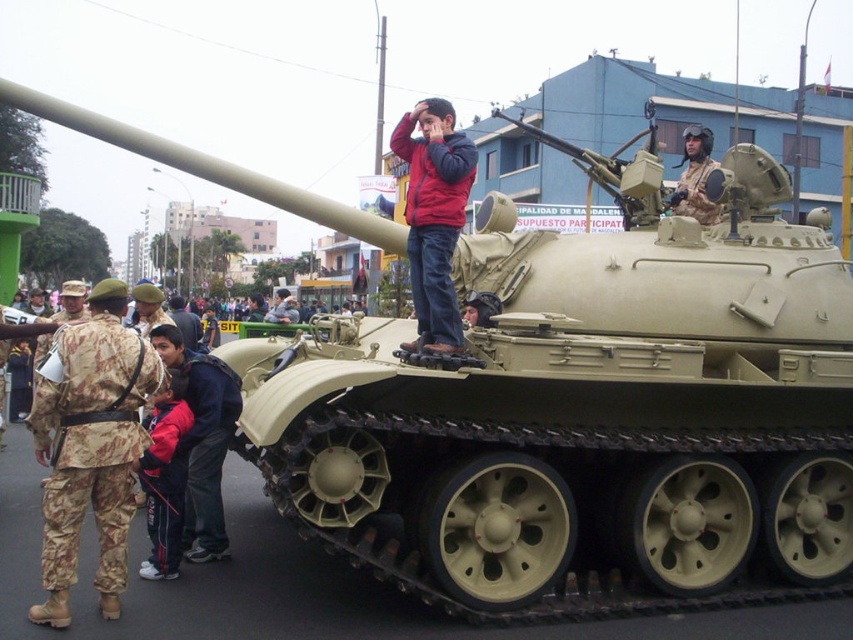
Can you confirm if red fleece jacket at lower left is taller than camouflage fabric helmet at upper center?

No.

Between red fleece jacket at lower left and camouflage fabric helmet at upper center, which one has less height?

red fleece jacket at lower left is shorter.

The image size is (853, 640). What do you see at coordinates (164, 480) in the screenshot?
I see `red fleece jacket at lower left` at bounding box center [164, 480].

Identify the location of red fleece jacket at lower left. The width and height of the screenshot is (853, 640). click(x=164, y=480).

Measure the distance between matte red jacket at center and red fleece jacket at lower left.

5.87 feet

Who is positioned more to the left, matte red jacket at center or red fleece jacket at lower left?

Positioned to the left is red fleece jacket at lower left.

Find the location of `matte red jacket at center`. matte red jacket at center is located at coordinates (434, 216).

Does matte red jacket at center have a lesser height compared to camouflage fabric helmet at upper center?

Indeed, matte red jacket at center has a lesser height compared to camouflage fabric helmet at upper center.

What do you see at coordinates (434, 216) in the screenshot?
I see `matte red jacket at center` at bounding box center [434, 216].

At what (x,y) coordinates should I click in order to perform the action: click on matte red jacket at center. Please return your answer as a coordinate pair (x, y). The height and width of the screenshot is (640, 853). Looking at the image, I should click on pos(434,216).